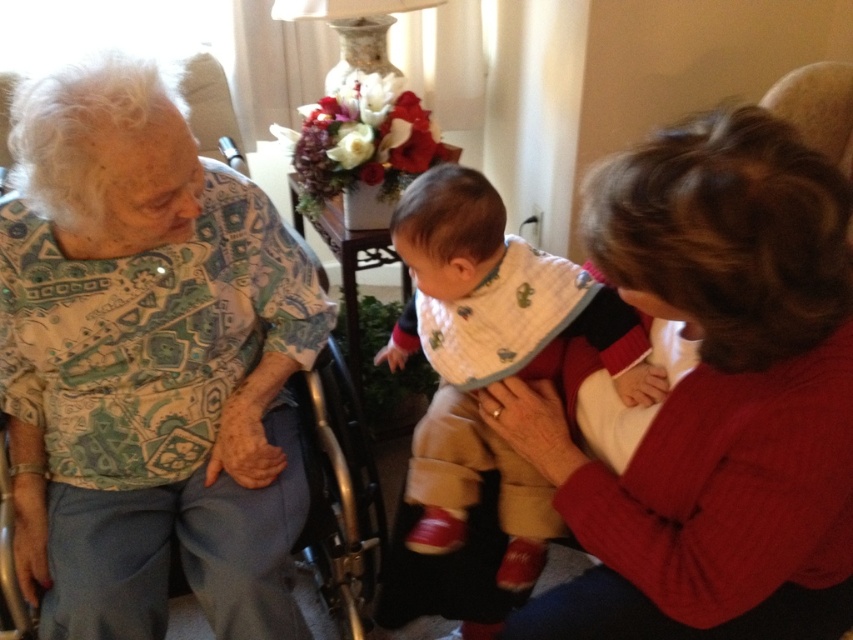
Question: Can you confirm if matte red sweater at center is thinner than white cotton bib at center?

Choices:
 (A) no
 (B) yes

Answer: (A)

Question: Estimate the real-world distances between objects in this image. Which object is closer to the white cotton bib at center?

Choices:
 (A) matte red sweater at center
 (B) printed fabric shirt at left

Answer: (A)

Question: Which point is farther to the camera?

Choices:
 (A) (506, 449)
 (B) (251, 518)

Answer: (A)

Question: Estimate the real-world distances between objects in this image. Which object is closer to the matte red sweater at center?

Choices:
 (A) printed fabric shirt at left
 (B) white cotton bib at center

Answer: (B)

Question: Observing the image, what is the correct spatial positioning of printed fabric shirt at left in reference to matte red sweater at center?

Choices:
 (A) right
 (B) left

Answer: (B)

Question: Does matte red sweater at center appear under white cotton bib at center?

Choices:
 (A) no
 (B) yes

Answer: (A)